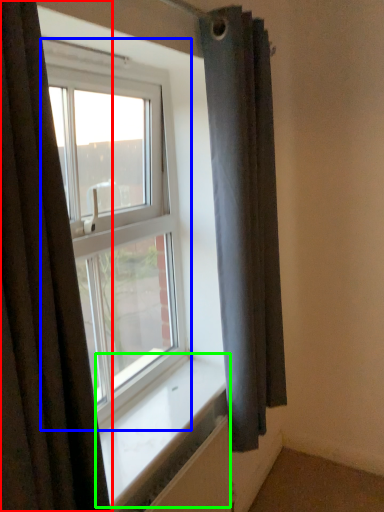
Question: Based on their relative distances, which object is nearer to curtain (highlighted by a red box)? Choose from window (highlighted by a blue box) and window sill (highlighted by a green box).

Choices:
 (A) window
 (B) window sill

Answer: (B)